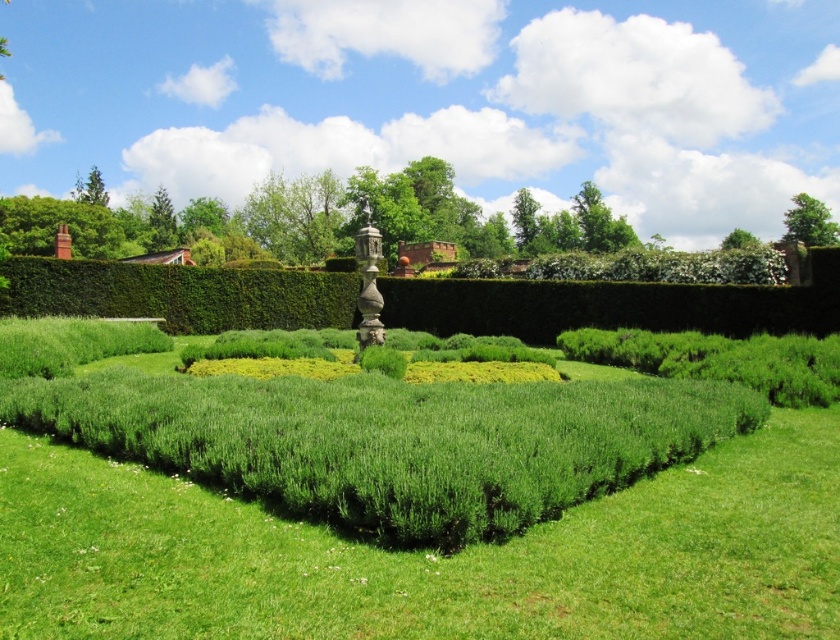
You are planning to place a small garden ornament that requires a space of 1 meter in diameter. Based on the scene, which area would be suitable between the green soft grass at center and the green leafy bush at upper right?

The green soft grass at center has a smaller size compared to the green leafy bush at upper right, so the green soft grass at center is more suitable for placing the ornament as it requires a space of 1 meter in diameter.

You are a gardener planning to plant a new flower bed in the garden. You need to choose between the green soft grass at center and the green leafy bush at upper right as the location. Which area has a narrower width to accommodate smaller plants?

The green soft grass at center is thinner than the green leafy bush at upper right, so the green soft grass at center has a narrower width and is suitable for smaller plants.